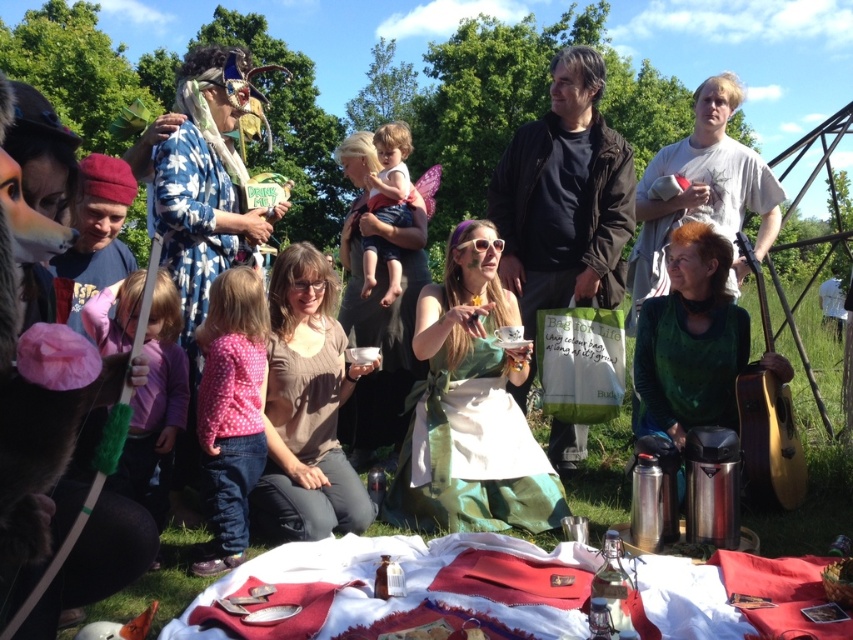
Does brown cotton shirt at center have a lesser height compared to green velvet dress at center?

No.

Who is shorter, brown cotton shirt at center or green velvet dress at center?

green velvet dress at center

You are a GUI agent. You are given a task and a screenshot of the screen. Output one action in this format:
    pyautogui.click(x=<x>, y=<y>)
    Task: Click on the brown cotton shirt at center
    
    Given the screenshot: What is the action you would take?
    pyautogui.click(x=306, y=408)

Where is `brown cotton shirt at center`? brown cotton shirt at center is located at coordinates (306, 408).

Is point (491, 442) positioned after point (318, 406)?

That is False.

You are a GUI agent. You are given a task and a screenshot of the screen. Output one action in this format:
    pyautogui.click(x=<x>, y=<y>)
    Task: Click on the green satin dress at center
    
    Given the screenshot: What is the action you would take?
    pyautogui.click(x=469, y=408)

Is point (413, 513) farther from camera compared to point (206, 461)?

That is True.

Is green satin dress at center smaller than pink dotted shirt at lower left?

No.

Which is in front, point (485, 353) or point (239, 444)?

Point (239, 444)

Find the location of a particular element. The width and height of the screenshot is (853, 640). green satin dress at center is located at coordinates (469, 408).